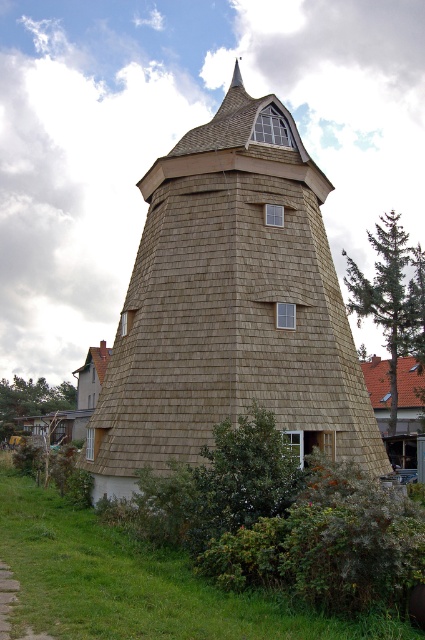
Does wooden shingle tower at center have a greater width compared to brown shingles at upper right?

Indeed, wooden shingle tower at center has a greater width compared to brown shingles at upper right.

Who is taller, wooden shingle tower at center or brown shingles at upper right?

wooden shingle tower at center

Which is behind, point (184, 422) or point (404, 360)?

Positioned behind is point (404, 360).

The width and height of the screenshot is (425, 640). I want to click on wooden shingle tower at center, so click(x=231, y=305).